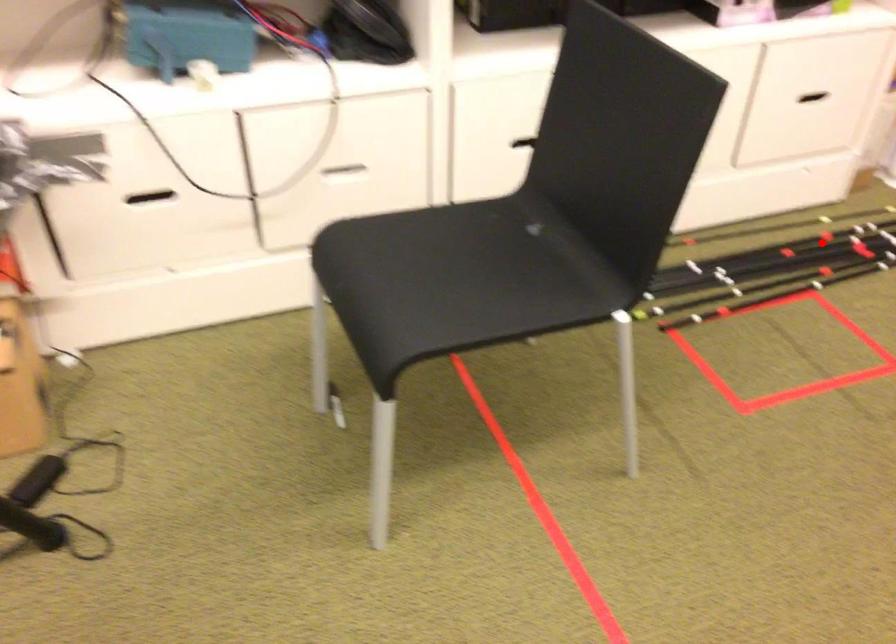
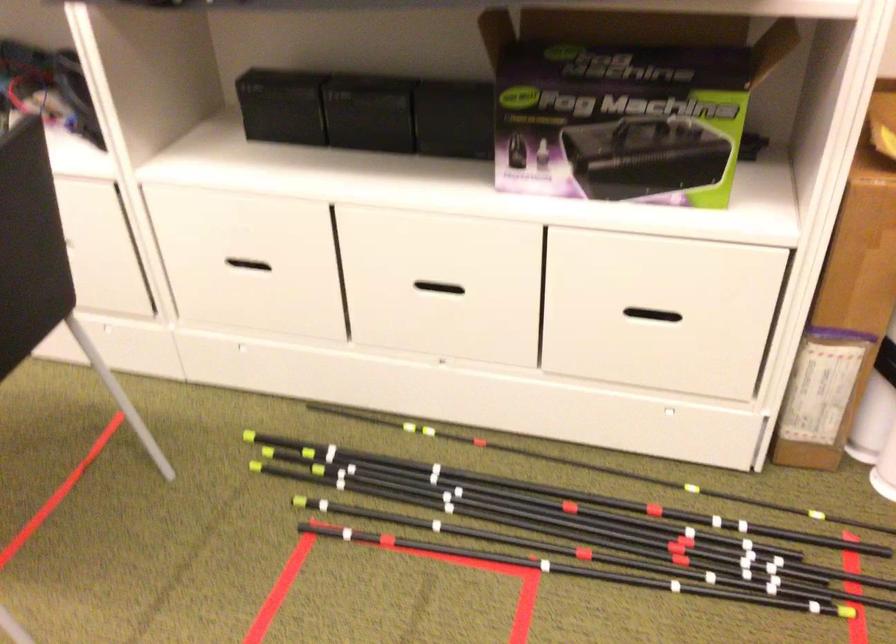
Question: I am providing you with two images of the same scene from different viewpoints. Image1 has a red point marked. In image2, the corresponding 3D location appears at what relative position? Reply with the corresponding letter.

Choices:
 (A) Closer
 (B) Farther

Answer: (A)